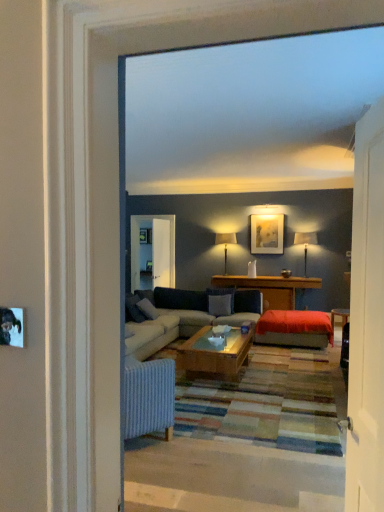
Question: Looking at their shapes, would you say matte black lampshade at center, which is the 2th lamp in front-to-back order, is wider or thinner than matte gold picture frame at upper center?

Choices:
 (A) thin
 (B) wide

Answer: (B)

Question: Is point pos(226,256) closer or farther from the camera than point pos(279,220)?

Choices:
 (A) closer
 (B) farther

Answer: (B)

Question: Which object is the farthest from the matte black lamp at upper right, which appears as the first lamp when viewed from the front?

Choices:
 (A) velvet red ottoman at center
 (B) clear glass screen door at center
 (C) white wooden door at right
 (D) wooden table at center
 (E) matte gold picture frame at upper center

Answer: (C)

Question: Based on their relative distances, which object is nearer to the matte black lamp at upper right, which is counted as the second lamp, starting from the left?

Choices:
 (A) velvet red ottoman at center
 (B) white wooden door at right
 (C) matte gold picture frame at upper center
 (D) clear glass screen door at center
 (E) matte black lampshade at center, which is the 2th lamp in right-to-left order

Answer: (C)